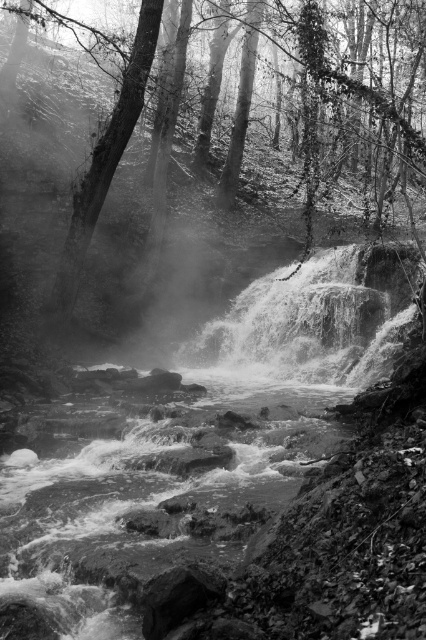
You are an environmental scientist assessing the health of this forest. You observe two smooth bark trees in the scene. Which tree has a wider trunk, the smooth bark tree at center or the smooth bark tree at left?

The smooth bark tree at center has a wider trunk than the smooth bark tree at left.

Looking at this image, you are standing at the edge of the waterfall and want to take a photo of the smooth bark tree at center. If your camera has a maximum focus range of 6 meters, will you need to adjust your position to capture it clearly?

The smooth bark tree at center is 6.49 meters away from the viewer. Since the camera can only focus up to 6 meters, you need to move closer to ensure the tree is within the focus range.

You are standing at the edge of the waterfall in the image and want to know how far the point at coordinates point (x=331, y=156) is from you. Can you determine the distance?

The distance of point (x=331, y=156) from viewer is 36.95 meters.